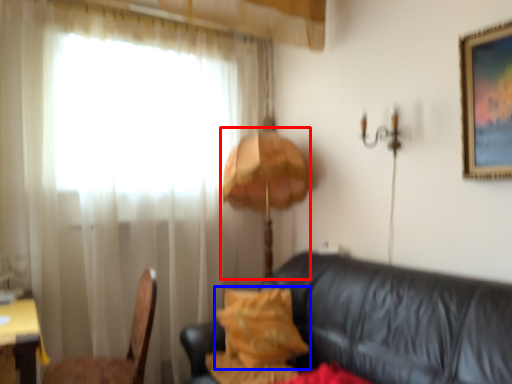
Question: Which point is closer to the camera, table lamp (highlighted by a red box) or pillow (highlighted by a blue box)?

Choices:
 (A) table lamp
 (B) pillow

Answer: (B)